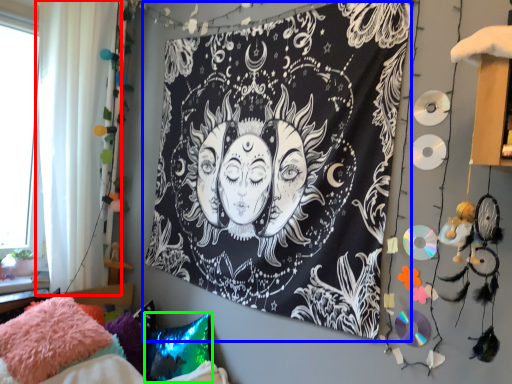
Question: Considering the real-world distances, which object is farthest from curtain (highlighted by a red box)? bulletin board (highlighted by a blue box) or pillow (highlighted by a green box)?

Choices:
 (A) bulletin board
 (B) pillow

Answer: (B)